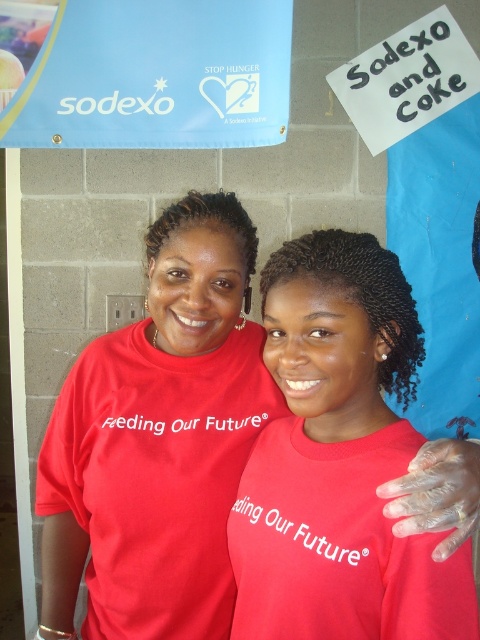
This screenshot has width=480, height=640. What are the coordinates of `matte red shirt at center` in the screenshot? It's located at (337, 460).

Is matte red shirt at center to the left of blue fabric sign at upper center from the viewer's perspective?

Incorrect, matte red shirt at center is not on the left side of blue fabric sign at upper center.

I want to click on matte red shirt at center, so 337,460.